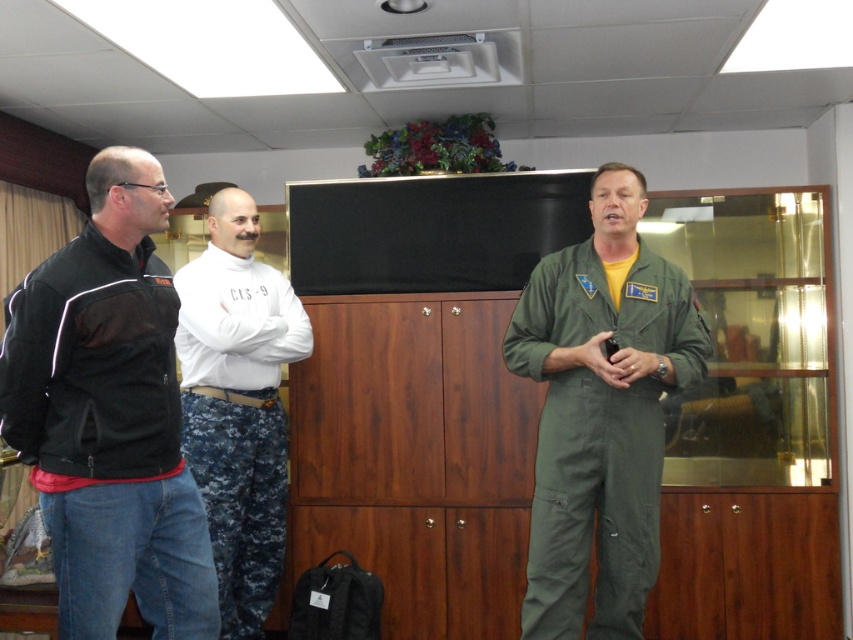
Who is more forward, (149, 433) or (228, 460)?

Point (149, 433) is more forward.

Describe the element at coordinates (109, 416) in the screenshot. I see `black mesh jacket at left` at that location.

At what (x,y) coordinates should I click in order to perform the action: click on black mesh jacket at left. Please return your answer as a coordinate pair (x, y). This screenshot has width=853, height=640. Looking at the image, I should click on (109, 416).

Is wooden cabinet at center smaller than green fabric jumpsuit at center?

No, wooden cabinet at center is not smaller than green fabric jumpsuit at center.

From the picture: Who is shorter, wooden cabinet at center or green fabric jumpsuit at center?

green fabric jumpsuit at center is shorter.

In the scene shown: Who is more forward, (358, 180) or (556, 308)?

Point (556, 308) is in front.

At what (x,y) coordinates should I click in order to perform the action: click on wooden cabinet at center. Please return your answer as a coordinate pair (x, y). The image size is (853, 640). Looking at the image, I should click on (421, 387).

Which is above, green fabric jumpsuit at center or white cotton shirt at center?

green fabric jumpsuit at center

Who is positioned more to the left, green fabric jumpsuit at center or white cotton shirt at center?

white cotton shirt at center

The height and width of the screenshot is (640, 853). I want to click on green fabric jumpsuit at center, so pyautogui.click(x=601, y=412).